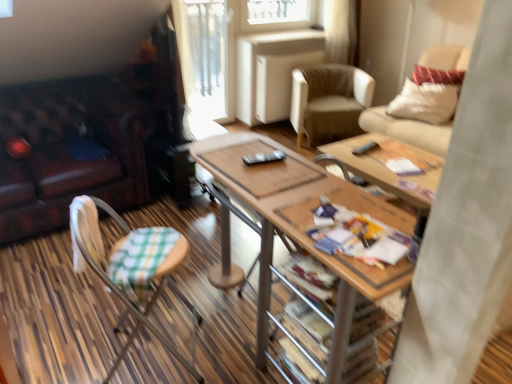
The image size is (512, 384). Identify the location of free space behind black plastic remote control at center, the second remote control positioned from the right. (258, 149).